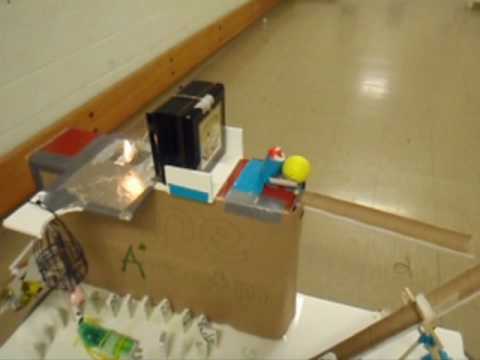
You are a GUI agent. You are given a task and a screenshot of the screen. Output one action in this format:
    pyautogui.click(x=<x>, y=<y>)
    Task: Click on the cardboard box
    Image resolution: width=480 pixels, height=360 pixels.
    Given the screenshot: What is the action you would take?
    pyautogui.click(x=216, y=260)